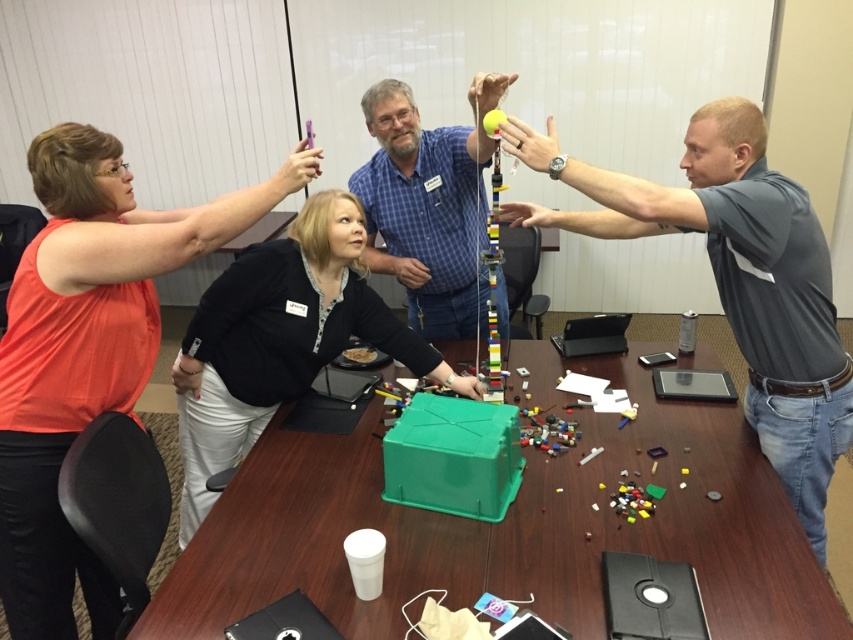
Between green plastic table at center and blue plaid shirt at center, which one is positioned lower?

green plastic table at center

Between point (355, 636) and point (399, 253), which one is positioned in front?

Point (355, 636) is more forward.

Is point (820, 588) behind point (412, 179)?

No, (820, 588) is closer to viewer.

Identify the location of green plastic table at center. This screenshot has width=853, height=640. (508, 525).

Between green plastic table at center and matte orange shirt at upper left, which one is positioned lower?

green plastic table at center is lower down.

How distant is green plastic table at center from matte orange shirt at upper left?

green plastic table at center is 31.95 inches from matte orange shirt at upper left.

Is point (769, 593) positioned in front of point (44, 321)?

That is True.

At what (x,y) coordinates should I click in order to perform the action: click on green plastic table at center. Please return your answer as a coordinate pair (x, y). The height and width of the screenshot is (640, 853). Looking at the image, I should click on (508, 525).

Measure the distance between matte orange shirt at upper left and camera.

4.60 feet

Does matte orange shirt at upper left lie in front of black matte jacket at center?

That is True.

Who is more distant from viewer, (103,305) or (320,212)?

The point (320,212) is more distant.

Image resolution: width=853 pixels, height=640 pixels. Identify the location of matte orange shirt at upper left. (88, 349).